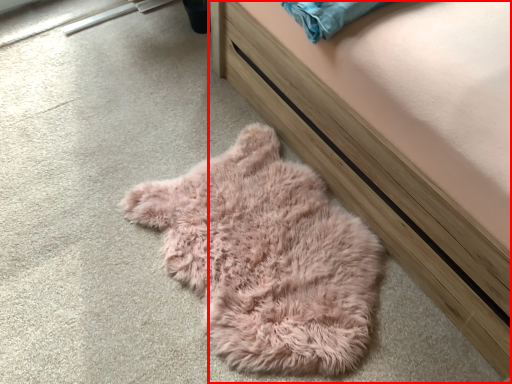
Question: From the image, what is the correct spatial relationship of furniture (annotated by the red box) in relation to sleeping bag?

Choices:
 (A) left
 (B) right

Answer: (B)